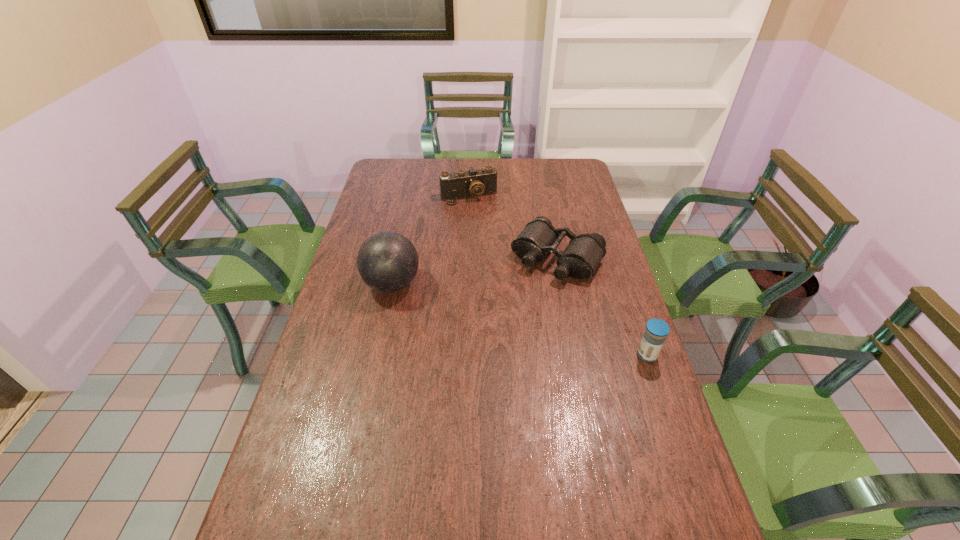
Find the location of a particular element. This screenshot has width=960, height=540. vacant space located on the left of the medicine is located at coordinates (587, 355).

Locate an element on the screen. The image size is (960, 540). free region located on the front-facing side of the camera is located at coordinates (505, 269).

You are a GUI agent. You are given a task and a screenshot of the screen. Output one action in this format:
    pyautogui.click(x=<x>, y=<y>)
    Task: Click on the blank space located 0.170m on the front-facing side of the camera
    Image resolution: width=960 pixels, height=540 pixels.
    Given the screenshot: What is the action you would take?
    pyautogui.click(x=487, y=230)

The image size is (960, 540). I want to click on vacant area located on the front-facing side of the camera, so click(x=502, y=262).

At what (x,y) coordinates should I click in order to perform the action: click on free region located 0.130m through the eyepieces of the binoculars. Please return your answer as a coordinate pair (x, y). Looking at the image, I should click on (519, 308).

Image resolution: width=960 pixels, height=540 pixels. I want to click on free space located 0.380m through the eyepieces of the binoculars, so click(479, 365).

Locate an element on the screen. vacant area situated through the eyepieces of the binoculars is located at coordinates (493, 345).

Locate an element on the screen. The image size is (960, 540). object at the left edge is located at coordinates (387, 261).

Find the location of a particular element. The height and width of the screenshot is (540, 960). medicine present at the right edge is located at coordinates (654, 336).

The width and height of the screenshot is (960, 540). I want to click on binoculars at the right edge, so click(579, 260).